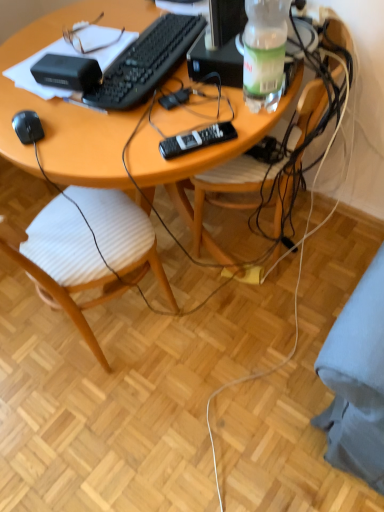
Find the location of a particular element. The width and height of the screenshot is (384, 512). free point to the right of black matte computer mouse at lower left is located at coordinates coord(96,127).